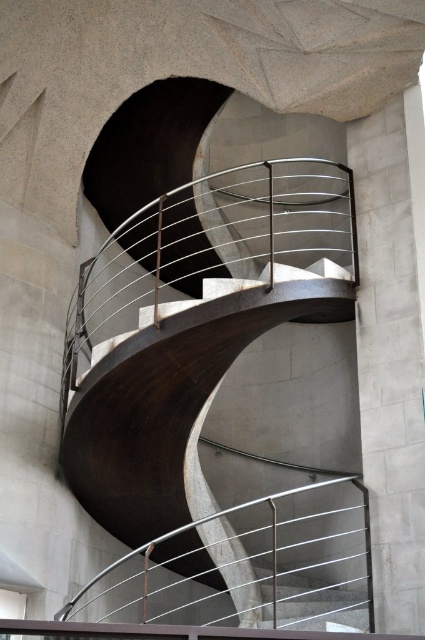
You are standing at point A with coordinates 0.4, 0.8 in the image. Which direction should you move to reach the satin silver metal stair at center?

The satin silver metal stair at center is located at point (x=391, y=349). Since you are at (x=340, y=256), you should move northeast to reach it.

You are an architect designing a new building and want to place a 10 meter long sculpture between the satin silver metal stair at center and the satin silver metal stairs at center. Is there enough space between them to fit the sculpture?

The distance between the satin silver metal stair at center and the satin silver metal stairs at center is 9.32 meters. Since the sculpture is 10 meters long, it will not fit between them as the space is shorter than the sculpture.

You are an architect reviewing the design of a spiral staircase. You notice two components labeled satin silver metal stair at center and satin silver metal stairs at center. Which component is located to the right of the other?

The satin silver metal stair at center is positioned on the right side of the satin silver metal stairs at center.